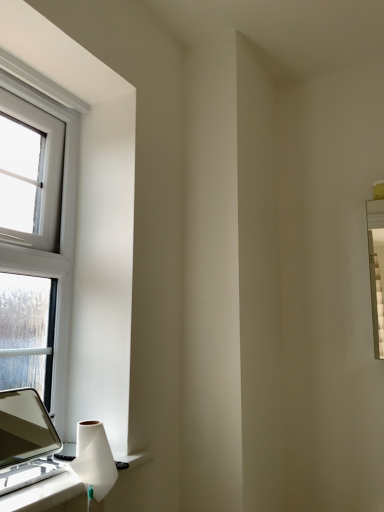
The height and width of the screenshot is (512, 384). Describe the element at coordinates (94, 460) in the screenshot. I see `white matte vase at lower left` at that location.

This screenshot has width=384, height=512. Find the location of `white matte vase at lower left`. white matte vase at lower left is located at coordinates (94, 460).

What is the approximate width of white matte vase at lower left?

white matte vase at lower left is 4.47 inches wide.

Identify the location of white matte vase at lower left. pos(94,460).